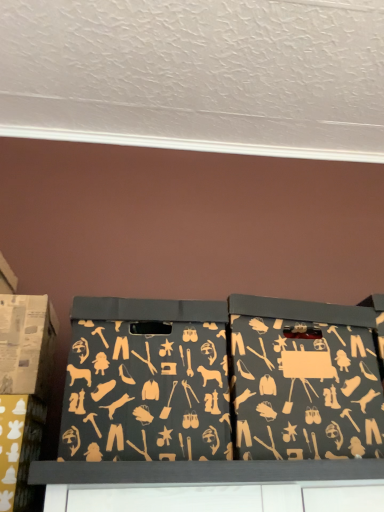
Question: Is matte black storage bin at lower left, the second box positioned from the left, in front of or behind matte black box at center, positioned as the fourth box in left-to-right order, in the image?

Choices:
 (A) behind
 (B) front

Answer: (A)

Question: From a real-world perspective, is matte black storage bin at lower left, the 3th box viewed from the right, physically located above or below matte black box at center, positioned as the fourth box in left-to-right order?

Choices:
 (A) below
 (B) above

Answer: (A)

Question: Which object is positioned farthest from the matte black storage box at center, the third box when ordered from left to right?

Choices:
 (A) matte black box at center, the first box when ordered from right to left
 (B) matte cardboard box at left, which appears as the fourth box when viewed from the right
 (C) matte black storage bin at lower left, the second box positioned from the left

Answer: (C)

Question: Which is farther from the matte black storage bin at lower left, the 3th box viewed from the right?

Choices:
 (A) matte black storage box at center, the second box viewed from the right
 (B) matte cardboard box at left, positioned as the 1th box in left-to-right order
 (C) matte black box at center, the first box when ordered from right to left

Answer: (C)